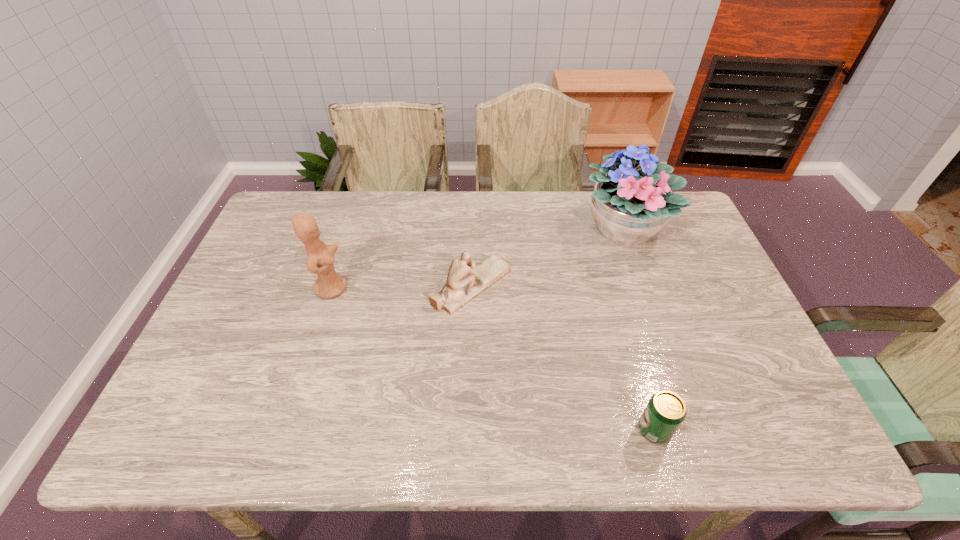
In the image, there is a desktop. Identify the location of blank space at the near left corner. (205, 418).

Image resolution: width=960 pixels, height=540 pixels. What are the coordinates of `unoccupied area between the taller figurine and the bouquet` in the screenshot? It's located at (477, 258).

Locate an element on the screen. The height and width of the screenshot is (540, 960). free spot between the beer can and the taller figurine is located at coordinates (493, 359).

Locate an element on the screen. blank region between the third tallest object and the bouquet is located at coordinates (547, 257).

Identify the location of free space between the left figurine and the right figurine. (401, 287).

The image size is (960, 540). Identify the location of empty space that is in between the bouquet and the shortest object. (639, 329).

Where is `vacant space that's between the bouquet and the shorter figurine`? vacant space that's between the bouquet and the shorter figurine is located at coordinates (547, 257).

The width and height of the screenshot is (960, 540). In order to click on vacant space in between the left figurine and the bouquet in this screenshot , I will do `click(477, 258)`.

Identify the location of empty space between the shortest object and the shorter figurine. This screenshot has width=960, height=540. (563, 357).

The height and width of the screenshot is (540, 960). Identify the location of vacant area between the bouquet and the beer can. (639, 329).